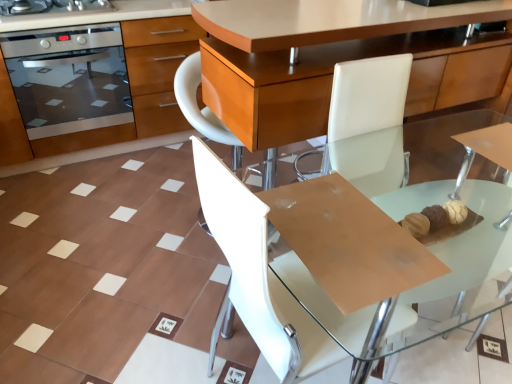
The height and width of the screenshot is (384, 512). In order to click on vacant space that is to the left of transparent glass table at center in this screenshot , I will do `click(146, 296)`.